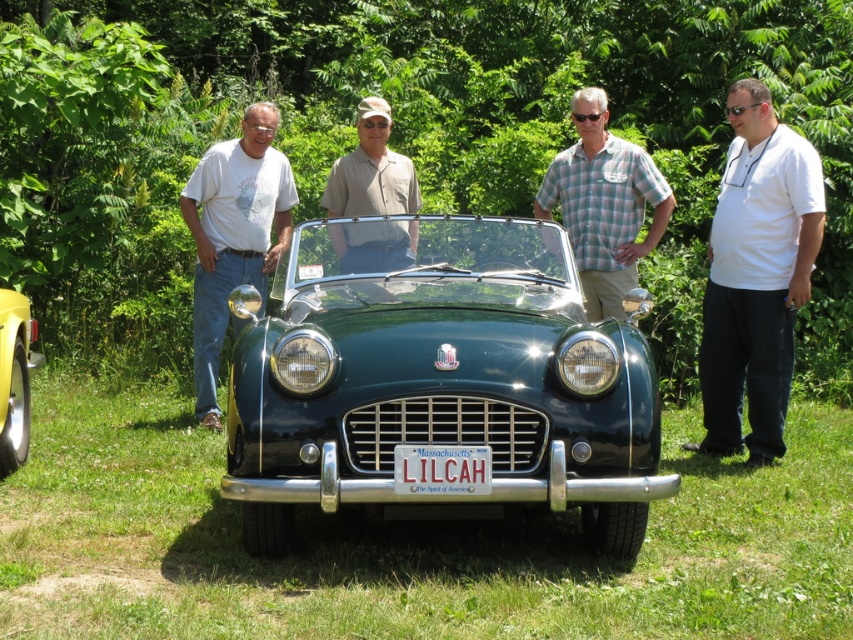
Does white matte t-shirt at left appear on the left side of plaid shirt at center?

Yes, white matte t-shirt at left is to the left of plaid shirt at center.

Is white matte t-shirt at left smaller than plaid shirt at center?

No, white matte t-shirt at left is not smaller than plaid shirt at center.

Does point (200, 310) come in front of point (583, 275)?

No, (200, 310) is behind (583, 275).

In order to click on white matte t-shirt at left in this screenshot , I will do `click(233, 236)`.

Who is higher up, khaki fabric shirt at center or white plastic license plate at center?

Positioned higher is khaki fabric shirt at center.

Locate an element on the screen. This screenshot has width=853, height=640. khaki fabric shirt at center is located at coordinates (370, 170).

The width and height of the screenshot is (853, 640). I want to click on khaki fabric shirt at center, so click(x=370, y=170).

Image resolution: width=853 pixels, height=640 pixels. I want to click on khaki fabric shirt at center, so click(x=370, y=170).

Who is shorter, white smooth shirt at center or yellow matte car at lower left?

yellow matte car at lower left is shorter.

Can you confirm if white smooth shirt at center is thinner than yellow matte car at lower left?

Incorrect, white smooth shirt at center's width is not less than yellow matte car at lower left's.

Where is `white smooth shirt at center`? The height and width of the screenshot is (640, 853). white smooth shirt at center is located at coordinates (756, 276).